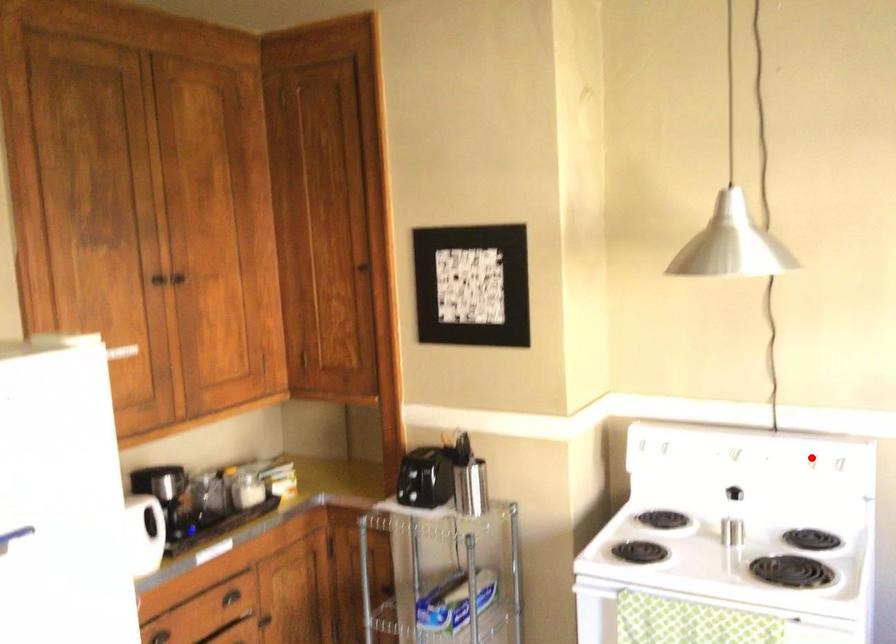
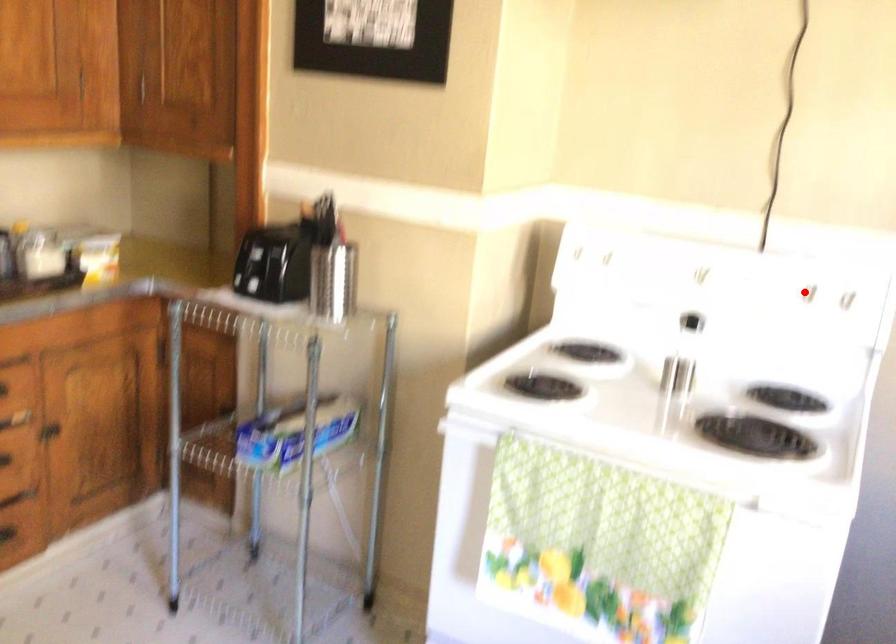
I am providing you with two images of the same scene from different viewpoints. A red point is marked on the first image and another point is marked on the second image. Do the highlighted points in image1 and image2 indicate the same real-world spot?

Yes